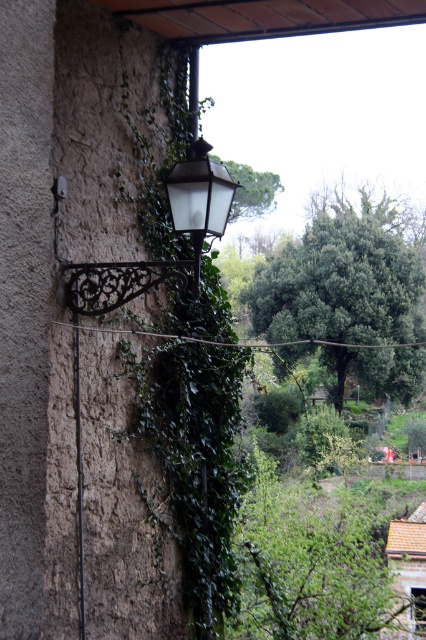
Looking at this image, can you confirm if white frosted glass lantern at upper center is positioned to the left of green leafy tree at upper center?

Yes, white frosted glass lantern at upper center is to the left of green leafy tree at upper center.

Looking at this image, is white frosted glass lantern at upper center closer to camera compared to green leafy tree at upper center?

Yes, white frosted glass lantern at upper center is in front of green leafy tree at upper center.

Is point (196, 234) less distant than point (278, 182)?

Yes, point (196, 234) is in front of point (278, 182).

I want to click on white frosted glass lantern at upper center, so click(x=199, y=198).

From the picture: Is green leafy tree at center above white frosted glass lantern at upper center?

Yes, green leafy tree at center is above white frosted glass lantern at upper center.

Is green leafy tree at center positioned in front of white frosted glass lantern at upper center?

No, green leafy tree at center is behind white frosted glass lantern at upper center.

Where is `green leafy tree at center`? The height and width of the screenshot is (640, 426). green leafy tree at center is located at coordinates pyautogui.click(x=342, y=280).

Does green leafy tree at center have a smaller size compared to green leafy tree at upper center?

Yes, green leafy tree at center is smaller than green leafy tree at upper center.

Who is higher up, green leafy tree at center or green leafy tree at upper center?

green leafy tree at upper center is above.

Does point (322, 269) lie behind point (264, 193)?

No, (322, 269) is closer to viewer.

I want to click on green leafy tree at center, so click(x=342, y=280).